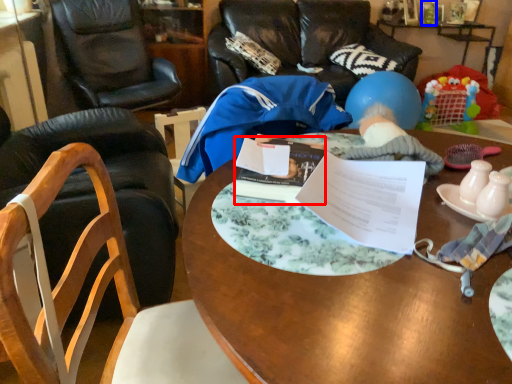
Question: Which point is further to the camera, book (highlighted by a red box) or bottle (highlighted by a blue box)?

Choices:
 (A) book
 (B) bottle

Answer: (B)